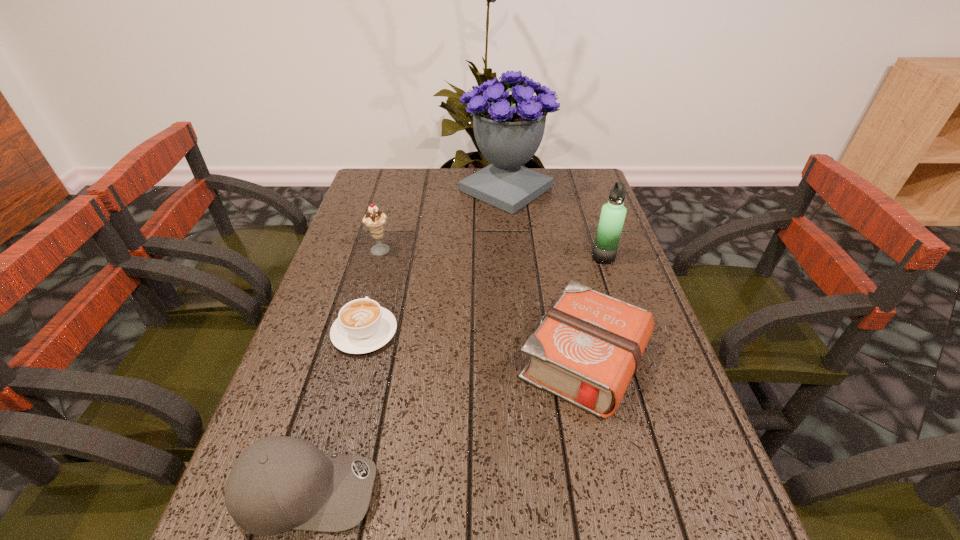
You are a GUI agent. You are given a task and a screenshot of the screen. Output one action in this format:
    pyautogui.click(x=<x>, y=<y>)
    Task: Click on the thermos bottle that is at the right edge
    The image size is (960, 540).
    Given the screenshot: What is the action you would take?
    pyautogui.click(x=613, y=213)

Where is `Bible at the right edge`? Bible at the right edge is located at coordinates (587, 348).

The width and height of the screenshot is (960, 540). I want to click on object present at the far right corner, so click(508, 128).

Locate an element on the screen. The height and width of the screenshot is (540, 960). free space at the far edge of the desktop is located at coordinates (421, 181).

In the image, there is a desktop. In order to click on free space at the left edge in this screenshot , I will do `click(348, 213)`.

In the image, there is a desktop. Where is `free region at the right edge`? free region at the right edge is located at coordinates (640, 281).

Locate an element on the screen. free space at the far left corner of the desktop is located at coordinates (386, 172).

Find the location of a particular element. This screenshot has width=960, height=540. free area in between the nearest object and the Bible is located at coordinates (445, 425).

This screenshot has width=960, height=540. In order to click on free area in between the farthest object and the fifth shortest object in this screenshot , I will do `click(555, 224)`.

Image resolution: width=960 pixels, height=540 pixels. Identify the location of empty space that is in between the bouquet and the fourth shortest object. (444, 220).